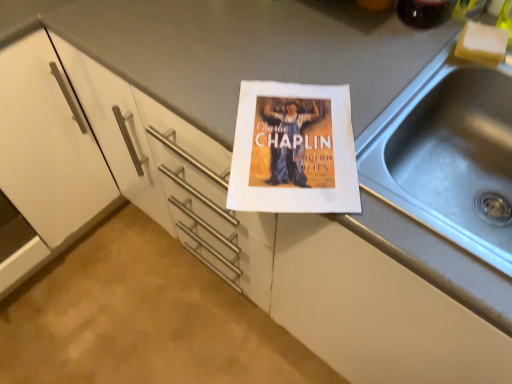
Locate an element on the screen. silver metallic sink at right is located at coordinates (448, 155).

The height and width of the screenshot is (384, 512). What are the coordinates of `white sponge at upper right` in the screenshot? It's located at (482, 44).

I want to click on silver metallic sink at right, so click(448, 155).

Looking at this image, considering the relative sizes of translucent glass beverage at upper right and white sponge at upper right in the image provided, is translucent glass beverage at upper right smaller than white sponge at upper right?

No, translucent glass beverage at upper right is not smaller than white sponge at upper right.

Is translucent glass beverage at upper right turned away from white sponge at upper right?

No, translucent glass beverage at upper right's orientation is not away from white sponge at upper right.

Is translucent glass beverage at upper right thinner than white sponge at upper right?

In fact, translucent glass beverage at upper right might be wider than white sponge at upper right.

Which of these two, translucent glass beverage at upper right or white sponge at upper right, stands shorter?

white sponge at upper right is shorter.

Based on the photo, from a real-world perspective, is silver metallic sink at right located beneath translucent glass beverage at upper right?

Yes, from a real-world perspective, silver metallic sink at right is beneath translucent glass beverage at upper right.

Considering the positions of objects silver metallic sink at right and translucent glass beverage at upper right in the image provided, who is more to the right, silver metallic sink at right or translucent glass beverage at upper right?

silver metallic sink at right is more to the right.

Which is further, [438,80] or [434,13]?

Point [434,13]

Is silver metallic sink at right bigger than translucent glass beverage at upper right?

Indeed, silver metallic sink at right has a larger size compared to translucent glass beverage at upper right.

Considering the sizes of objects translucent glass beverage at upper right and silver metallic sink at right in the image provided, who is thinner, translucent glass beverage at upper right or silver metallic sink at right?

translucent glass beverage at upper right.

At what (x,y) coordinates should I click in order to perform the action: click on beverage on the left of silver metallic sink at right. Please return your answer as a coordinate pair (x, y). Image resolution: width=512 pixels, height=384 pixels. Looking at the image, I should click on (424, 12).

Does translucent glass beverage at upper right have a smaller size compared to silver metallic sink at right?

Indeed, translucent glass beverage at upper right has a smaller size compared to silver metallic sink at right.

From a real-world perspective, is translucent glass beverage at upper right located higher than silver metallic sink at right?

Yes.

In the scene shown: Which is less distant, (501,41) or (482,130)?

The point (501,41) is closer to the camera.

Does white sponge at upper right turn towards silver metallic sink at right?

Yes, white sponge at upper right is oriented towards silver metallic sink at right.

From a real-world perspective, does white sponge at upper right stand above silver metallic sink at right?

Yes, from a real-world perspective, white sponge at upper right is above silver metallic sink at right.

Which is more to the left, white sponge at upper right or silver metallic sink at right?

From the viewer's perspective, silver metallic sink at right appears more on the left side.

Can white sponge at upper right be found inside silver metallic sink at right?

Absolutely, white sponge at upper right is inside silver metallic sink at right.

How different are the orientations of silver metallic sink at right and white sponge at upper right in degrees?

18.3 degrees.

Is silver metallic sink at right at the left side of white sponge at upper right?

Correct, you'll find silver metallic sink at right to the left of white sponge at upper right.

Image resolution: width=512 pixels, height=384 pixels. I want to click on food that is under the translucent glass beverage at upper right (from a real-world perspective), so click(482, 44).

Based on their positions, is white sponge at upper right located to the left or right of translucent glass beverage at upper right?

Clearly, white sponge at upper right is on the right of translucent glass beverage at upper right in the image.

Is white sponge at upper right smaller than translucent glass beverage at upper right?

Yes.

Which object is further away from the camera, white sponge at upper right or translucent glass beverage at upper right?

white sponge at upper right is behind.

This screenshot has height=384, width=512. Identify the location of beverage above the white sponge at upper right (from a real-world perspective). (424, 12).

I want to click on beverage behind the silver metallic sink at right, so click(x=424, y=12).

Considering their positions, is white sponge at upper right positioned further to silver metallic sink at right than translucent glass beverage at upper right?

The object further to silver metallic sink at right is translucent glass beverage at upper right.

Based on their spatial positions, is silver metallic sink at right or translucent glass beverage at upper right further from white sponge at upper right?

silver metallic sink at right is positioned further to the anchor white sponge at upper right.

From the image, which object appears to be nearer to translucent glass beverage at upper right, silver metallic sink at right or white sponge at upper right?

The object closer to translucent glass beverage at upper right is white sponge at upper right.

Estimate the real-world distances between objects in this image. Which object is closer to white sponge at upper right, translucent glass beverage at upper right or silver metallic sink at right?

translucent glass beverage at upper right.

Estimate the real-world distances between objects in this image. Which object is closer to silver metallic sink at right, translucent glass beverage at upper right or white sponge at upper right?

white sponge at upper right is positioned closer to the anchor silver metallic sink at right.

Looking at the image, which one is located closer to translucent glass beverage at upper right, white sponge at upper right or silver metallic sink at right?

Among the two, white sponge at upper right is located nearer to translucent glass beverage at upper right.

Image resolution: width=512 pixels, height=384 pixels. What are the coordinates of `food between translucent glass beverage at upper right and silver metallic sink at right vertically` in the screenshot? It's located at (482, 44).